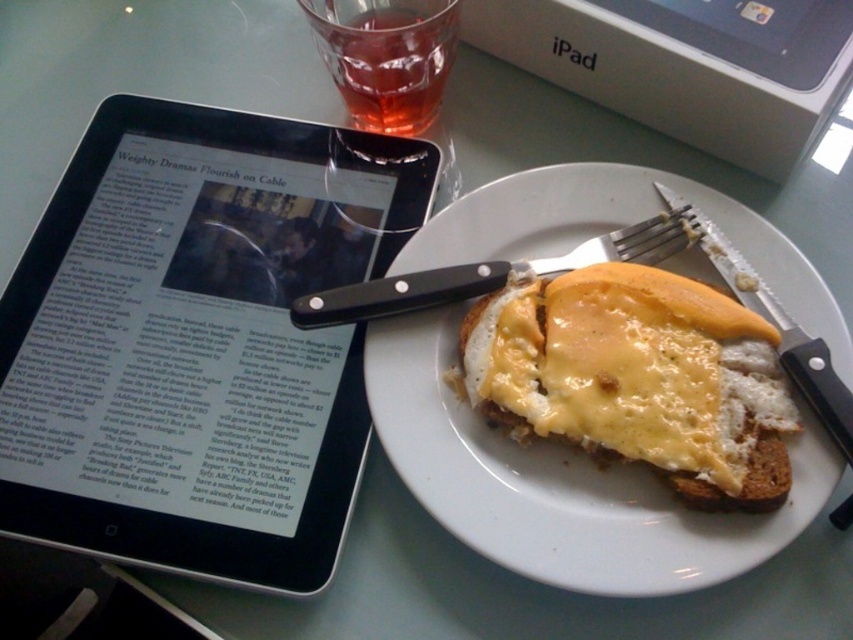
Which is behind, point (587, 548) or point (636, 262)?

Positioned behind is point (636, 262).

Which is below, white ceramic plate at center or black plastic fork at upper right?

white ceramic plate at center is lower down.

This screenshot has width=853, height=640. Describe the element at coordinates (561, 483) in the screenshot. I see `white ceramic plate at center` at that location.

You are a GUI agent. You are given a task and a screenshot of the screen. Output one action in this format:
    pyautogui.click(x=<x>, y=<y>)
    Task: Click on the white ceramic plate at center
    
    Given the screenshot: What is the action you would take?
    pyautogui.click(x=561, y=483)

Can you confirm if black glossy tablet at upper left is smaller than white ceramic plate at center?

No, black glossy tablet at upper left is not smaller than white ceramic plate at center.

Can you confirm if black glossy tablet at upper left is bigger than white ceramic plate at center?

Yes, black glossy tablet at upper left is bigger than white ceramic plate at center.

Locate an element on the screen. The width and height of the screenshot is (853, 640). black glossy tablet at upper left is located at coordinates (198, 340).

Consider the image. Can you confirm if white ceramic plate at center is thinner than slightly toasted bread with melted cheese at center?

In fact, white ceramic plate at center might be wider than slightly toasted bread with melted cheese at center.

Who is taller, white ceramic plate at center or slightly toasted bread with melted cheese at center?

Standing taller between the two is white ceramic plate at center.

Is point (438, 321) farther from viewer compared to point (611, 436)?

Yes, point (438, 321) is farther from viewer.

I want to click on white ceramic plate at center, so 561,483.